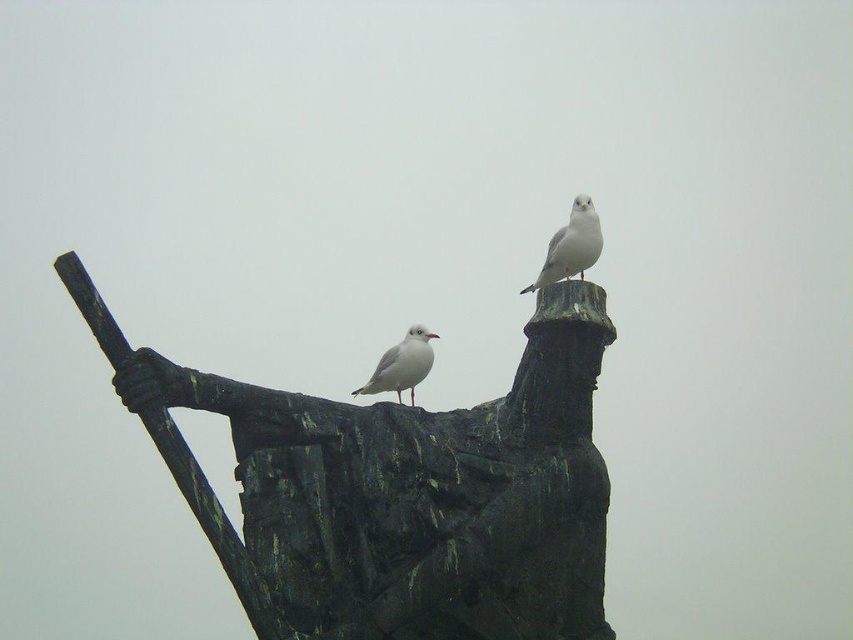
Can you confirm if green patina statue at center is thinner than white matte bird at center?

Incorrect, green patina statue at center's width is not less than white matte bird at center's.

Is point (590, 458) behind point (392, 356)?

No, (590, 458) is in front of (392, 356).

Between point (383, 620) and point (409, 333), which one is positioned behind?

Point (409, 333)

You are a GUI agent. You are given a task and a screenshot of the screen. Output one action in this format:
    pyautogui.click(x=<x>, y=<y>)
    Task: Click on the green patina statue at center
    
    Given the screenshot: What is the action you would take?
    coord(399,490)

How much distance is there between white matte bird at upper center and white matte bird at center?

The distance of white matte bird at upper center from white matte bird at center is 11.20 meters.

Can you confirm if white matte bird at upper center is positioned to the left of white matte bird at center?

Incorrect, white matte bird at upper center is not on the left side of white matte bird at center.

Who is more distant from viewer, (585, 204) or (373, 378)?

Positioned behind is point (585, 204).

The width and height of the screenshot is (853, 640). What are the coordinates of `white matte bird at upper center` in the screenshot? It's located at (572, 244).

Locate an element on the screen. The height and width of the screenshot is (640, 853). green patina statue at center is located at coordinates (399, 490).

Which is more to the right, green patina statue at center or white matte bird at upper center?

white matte bird at upper center is more to the right.

Who is more distant from viewer, [521,545] or [593,212]?

Point [593,212]

Locate an element on the screen. green patina statue at center is located at coordinates (399, 490).